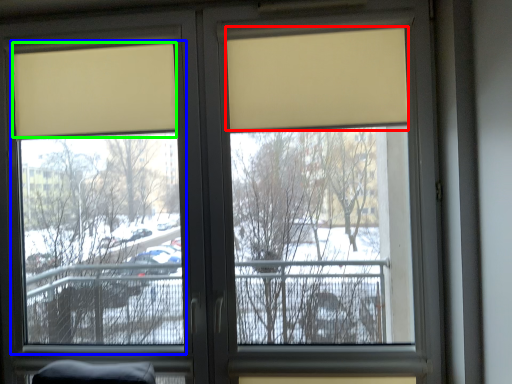
Question: Based on their relative distances, which object is farther from curtain (highlighted by a red box)? Choose from window screen (highlighted by a blue box) and curtain (highlighted by a green box).

Choices:
 (A) window screen
 (B) curtain

Answer: (A)